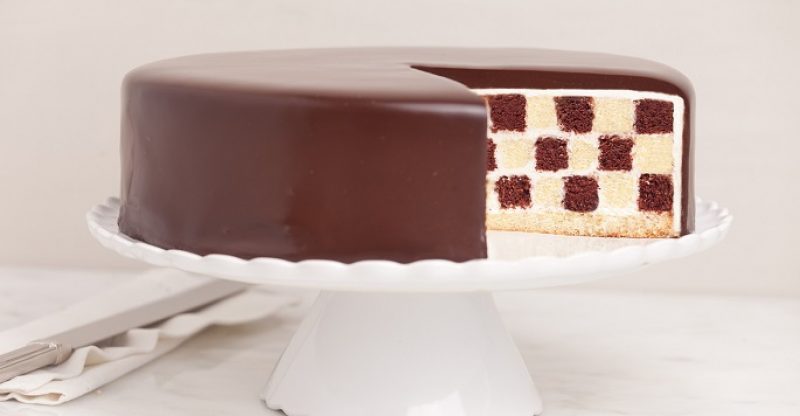
You are a GUI agent. You are given a task and a screenshot of the screen. Output one action in this format:
    pyautogui.click(x=<x>, y=<y>)
    Task: Click on the edge of cake plate
    This screenshot has height=416, width=800.
    Given the screenshot: What is the action you would take?
    pyautogui.click(x=320, y=265)